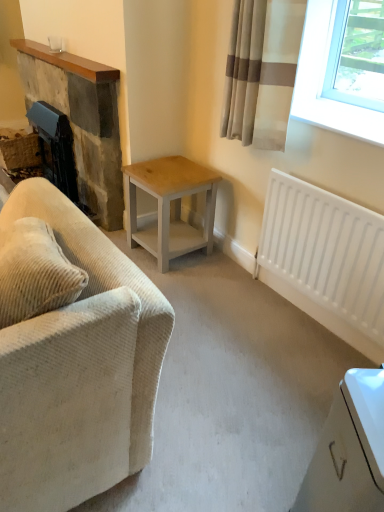
Question: Can you see light wood/grey painted table at center touching beige corduroy couch at left?

Choices:
 (A) yes
 (B) no

Answer: (B)

Question: Can you confirm if light wood/grey painted table at center is smaller than beige corduroy couch at left?

Choices:
 (A) no
 (B) yes

Answer: (B)

Question: Is light wood/grey painted table at center thinner than beige corduroy couch at left?

Choices:
 (A) yes
 (B) no

Answer: (A)

Question: Is light wood/grey painted table at center to the left of beige corduroy couch at left from the viewer's perspective?

Choices:
 (A) yes
 (B) no

Answer: (B)

Question: Is beige corduroy couch at left a part of light wood/grey painted table at center?

Choices:
 (A) yes
 (B) no

Answer: (B)

Question: Looking at their shapes, would you say rustic stone fireplace at left is wider or thinner than white matte radiator at lower right?

Choices:
 (A) wide
 (B) thin

Answer: (A)

Question: Is point (87, 189) positioned closer to the camera than point (360, 347)?

Choices:
 (A) farther
 (B) closer

Answer: (A)

Question: In the image, is rustic stone fireplace at left on the left side or the right side of white matte radiator at lower right?

Choices:
 (A) left
 (B) right

Answer: (A)

Question: Is rustic stone fireplace at left situated inside white matte radiator at lower right or outside?

Choices:
 (A) inside
 (B) outside

Answer: (B)

Question: Relative to light wood/grey painted table at center, is beige fabric curtain at upper right in front or behind?

Choices:
 (A) front
 (B) behind

Answer: (A)

Question: Is beige fabric curtain at upper right wider or thinner than light wood/grey painted table at center?

Choices:
 (A) thin
 (B) wide

Answer: (A)

Question: Would you say beige fabric curtain at upper right is inside or outside light wood/grey painted table at center?

Choices:
 (A) inside
 (B) outside

Answer: (B)

Question: Based on their positions, is beige fabric curtain at upper right located to the left or right of light wood/grey painted table at center?

Choices:
 (A) left
 (B) right

Answer: (B)

Question: Is rustic stone fireplace at left in front of or behind beige corduroy couch at left in the image?

Choices:
 (A) front
 (B) behind

Answer: (B)

Question: Is rustic stone fireplace at left to the left or to the right of beige corduroy couch at left in the image?

Choices:
 (A) right
 (B) left

Answer: (B)